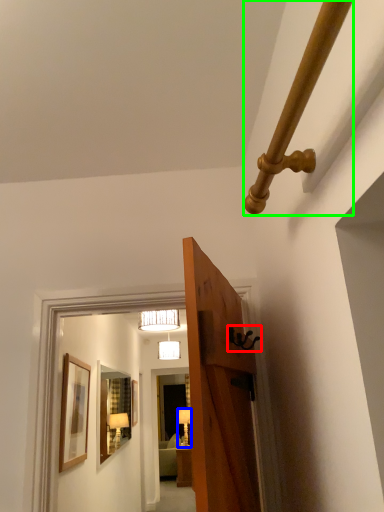
Question: Estimate the real-world distances between objects in this image. Which object is farther from door handle (highlighted by a red box), lamp (highlighted by a blue box) or beam (highlighted by a green box)?

Choices:
 (A) lamp
 (B) beam

Answer: (A)